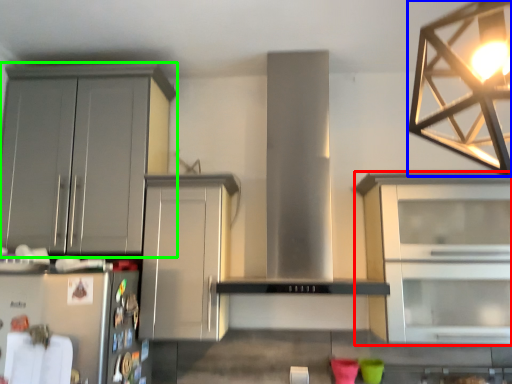
Question: Which is nearer to the cabinetry (highlighted by a red box)? lamp (highlighted by a blue box) or cabinetry (highlighted by a green box).

Choices:
 (A) lamp
 (B) cabinetry

Answer: (A)